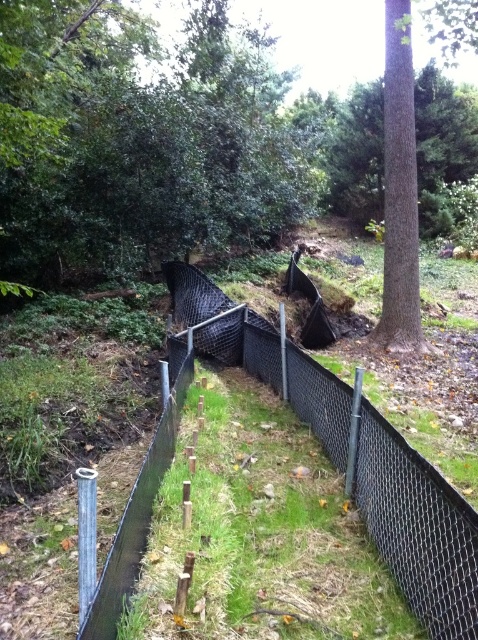
Question: Does brown textured tree at center appear over brown textured tree at upper right?

Choices:
 (A) no
 (B) yes

Answer: (B)

Question: Does brown textured tree at center have a smaller size compared to brown textured tree at upper right?

Choices:
 (A) yes
 (B) no

Answer: (B)

Question: Which point is closer to the camera?

Choices:
 (A) brown textured tree at center
 (B) black mesh fence at center
 (C) brown textured tree at upper right

Answer: (A)

Question: Which object is the farthest from the black mesh fence at center?

Choices:
 (A) brown textured tree at upper right
 (B) brown textured tree at center

Answer: (B)

Question: Is the position of black mesh fence at center more distant than that of brown textured tree at upper right?

Choices:
 (A) no
 (B) yes

Answer: (A)

Question: Which of these objects is positioned farthest from the brown textured tree at upper right?

Choices:
 (A) brown textured tree at center
 (B) black mesh fence at center

Answer: (A)